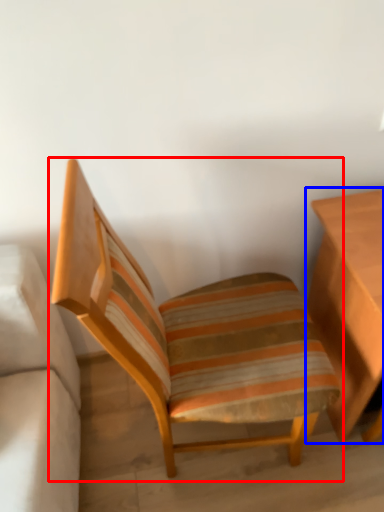
Question: Among these objects, which one is nearest to the camera, chair (highlighted by a red box) or table (highlighted by a blue box)?

Choices:
 (A) chair
 (B) table

Answer: (A)